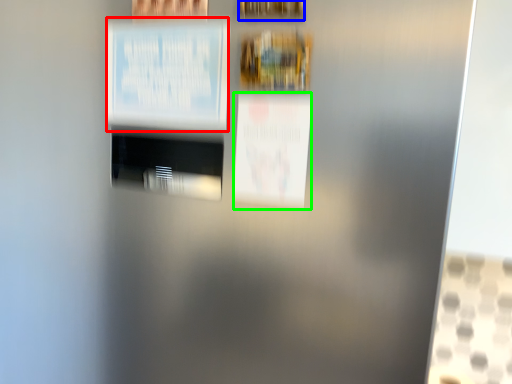
Question: Which object is positioned farthest from poster (highlighted by a red box)? Select from picture frame (highlighted by a blue box) and poster (highlighted by a green box).

Choices:
 (A) picture frame
 (B) poster

Answer: (A)